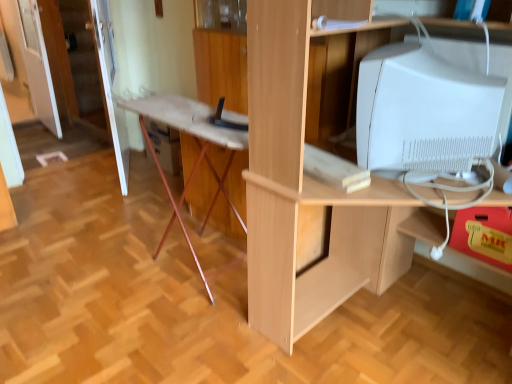
Question: Is light wood desk at center wider than yellow matte drawer at lower right?

Choices:
 (A) no
 (B) yes

Answer: (B)

Question: Is light wood desk at center not close to yellow matte drawer at lower right?

Choices:
 (A) yes
 (B) no

Answer: (B)

Question: Does light wood desk at center turn towards yellow matte drawer at lower right?

Choices:
 (A) yes
 (B) no

Answer: (B)

Question: Is light wood desk at center shorter than yellow matte drawer at lower right?

Choices:
 (A) no
 (B) yes

Answer: (A)

Question: Can you confirm if light wood desk at center is taller than yellow matte drawer at lower right?

Choices:
 (A) no
 (B) yes

Answer: (B)

Question: Is light wood desk at center smaller than yellow matte drawer at lower right?

Choices:
 (A) yes
 (B) no

Answer: (B)

Question: From the image's perspective, is transparent glass door at upper left under white glossy computer monitor at upper right?

Choices:
 (A) yes
 (B) no

Answer: (B)

Question: From the image's perspective, is transparent glass door at upper left located above white glossy computer monitor at upper right?

Choices:
 (A) yes
 (B) no

Answer: (A)

Question: Can you confirm if transparent glass door at upper left is smaller than white glossy computer monitor at upper right?

Choices:
 (A) no
 (B) yes

Answer: (A)

Question: From a real-world perspective, is transparent glass door at upper left on top of white glossy computer monitor at upper right?

Choices:
 (A) no
 (B) yes

Answer: (A)

Question: Considering the relative sizes of transparent glass door at upper left and white glossy computer monitor at upper right in the image provided, is transparent glass door at upper left thinner than white glossy computer monitor at upper right?

Choices:
 (A) no
 (B) yes

Answer: (B)

Question: Can you confirm if transparent glass door at upper left is positioned to the left of white glossy computer monitor at upper right?

Choices:
 (A) no
 (B) yes

Answer: (B)

Question: Does white glossy door at upper left, the 1th door positioned from the left, have a larger size compared to wooden ironing board at center?

Choices:
 (A) no
 (B) yes

Answer: (A)